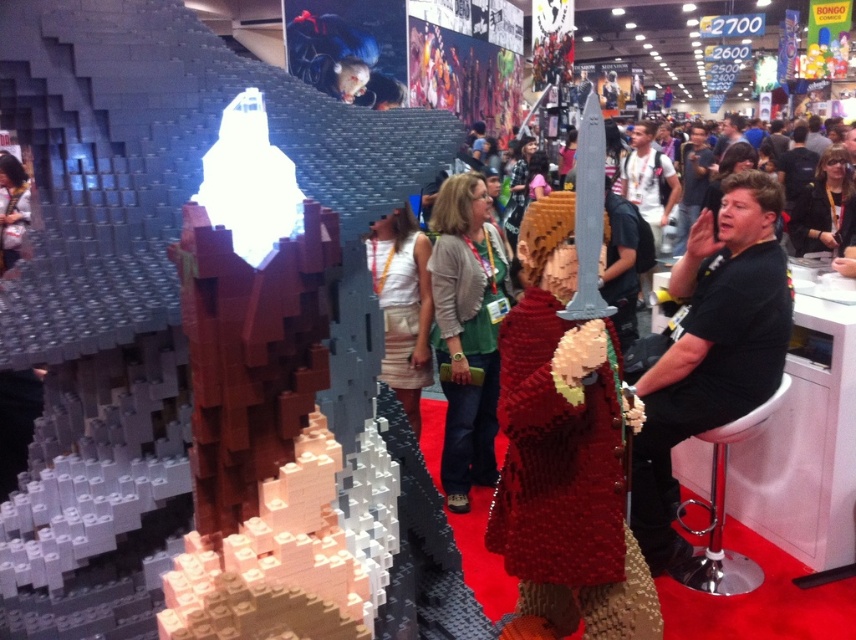
You are a photographer at the event and want to capture both the black matte shirt at right and the white fabric skirt at center in a single photo. However, you can only focus on one object at a time. Which object should you focus on to ensure the other remains in the background?

You should focus on the black matte shirt at right because it is in front of the white fabric skirt at center, so the skirt will naturally be in the background when the shirt is in focus.

Consider the image. You are at an event and want to take a photo of the red brick armor at center and the black matte shirt at right. Which object should you focus on first if you want to capture both in the same frame without moving the camera?

You should focus on the red brick armor at center first because it is positioned below the black matte shirt at right, so adjusting the camera to include both would require ensuring the lower object is in frame first.